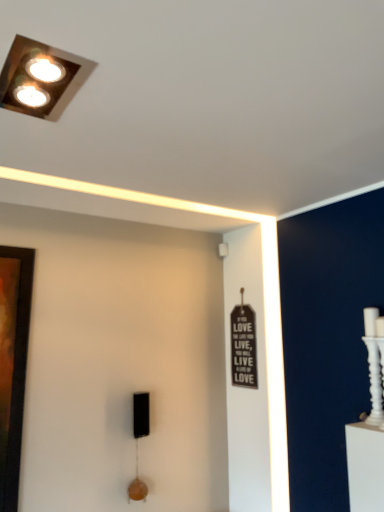
Question: From the image's perspective, is white textured candle holder at right located above or below metallic square light fixture at upper left?

Choices:
 (A) below
 (B) above

Answer: (A)

Question: Do you think white textured candle holder at right is within metallic square light fixture at upper left, or outside of it?

Choices:
 (A) inside
 (B) outside

Answer: (B)

Question: In terms of height, does white textured candle holder at right look taller or shorter compared to metallic square light fixture at upper left?

Choices:
 (A) tall
 (B) short

Answer: (A)

Question: Considering the positions of metallic square light fixture at upper left and white textured candle holder at right in the image, is metallic square light fixture at upper left wider or thinner than white textured candle holder at right?

Choices:
 (A) thin
 (B) wide

Answer: (B)

Question: Would you say metallic square light fixture at upper left is to the left or to the right of white textured candle holder at right in the picture?

Choices:
 (A) right
 (B) left

Answer: (B)

Question: Looking at the image, does metallic square light fixture at upper left seem bigger or smaller compared to white textured candle holder at right?

Choices:
 (A) small
 (B) big

Answer: (A)

Question: From the image's perspective, is metallic square light fixture at upper left above or below white textured candle holder at right?

Choices:
 (A) above
 (B) below

Answer: (A)